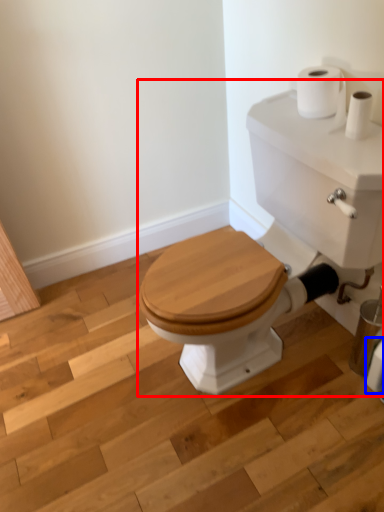
Question: Which object appears farthest to the camera in this image, porcelain (highlighted by a red box) or toilet paper (highlighted by a blue box)?

Choices:
 (A) porcelain
 (B) toilet paper

Answer: (B)